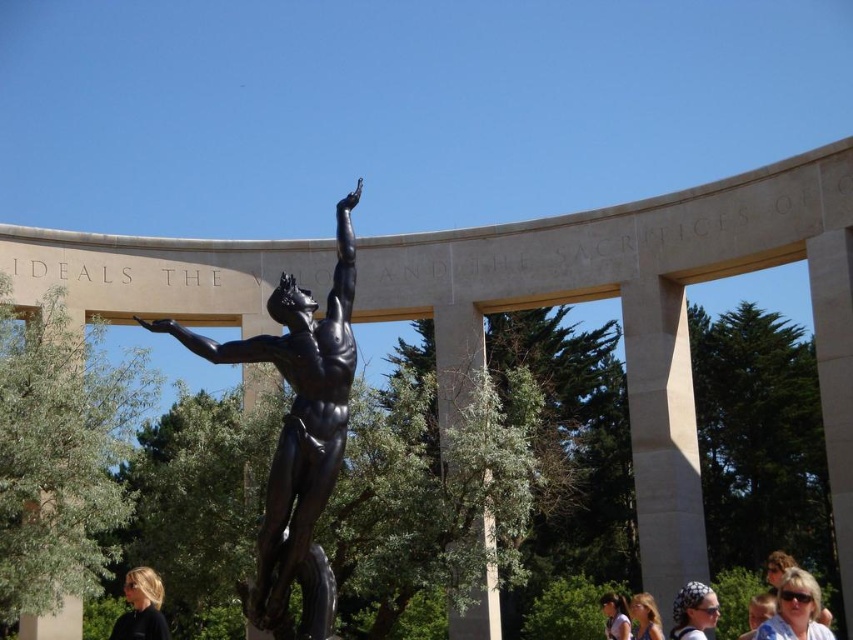
You are a photographer standing at the base of the bronze statue. You want to capture both the matte black hair at lower left and the light brown hair at lower center in the same frame. Given that your camera has a maximum zoom range of 100 meters, can you fit both subjects into the frame without moving your position?

The matte black hair at lower left and light brown hair at lower center are 35.81 meters apart from each other. Since your camera has a maximum zoom range of 100 meters, which is greater than the distance between them, you can fit both subjects into the frame without moving your position.

You are a photographer standing in front of the bronze statue. You notice two people in the scene with matte black hair at lower left and light brown hair at lower center. Which person is positioned closer to the statue?

The matte black hair at lower left is closer to the viewer than light brown hair at lower center, so the person with matte black hair at lower left is closer to the statue.

Consider the image. You are an artist sketching the statue and its surroundings. You notice the white printed headscarf at lower center and the matte black hair at lower right. Which of these two elements is taller in the image?

The white printed headscarf at lower center is taller than the matte black hair at lower right according to the description.